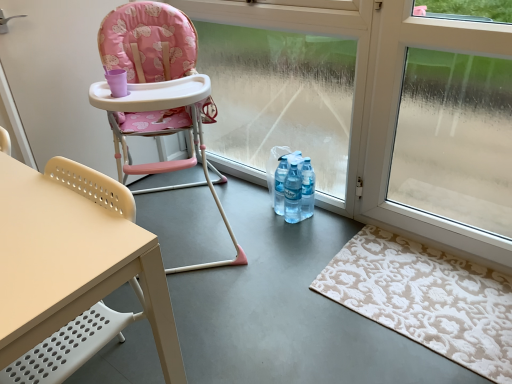
This screenshot has height=384, width=512. What are the coordinates of `spots to the right of translucent plastic bottles at center` in the screenshot? It's located at (333, 219).